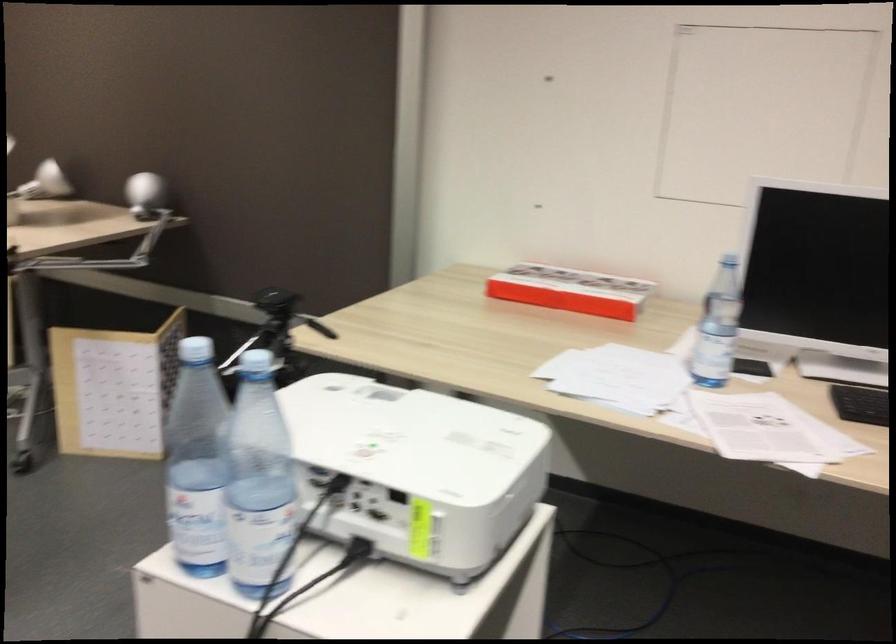
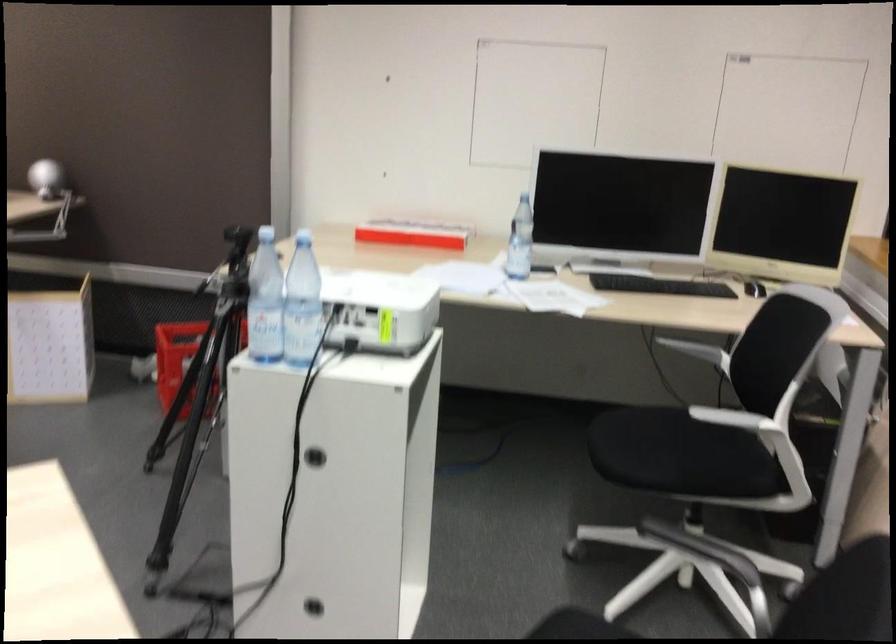
Find the pixel in the second image that matches [436,498] in the first image.

(380, 308)